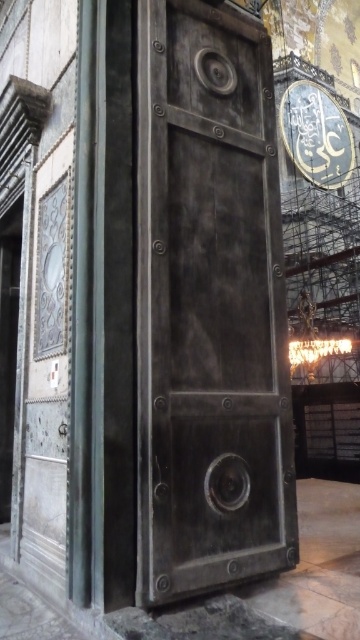
Does rusty metal door at center have a smaller size compared to shiny metallic clock at center?

Yes, rusty metal door at center is smaller than shiny metallic clock at center.

Is rusty metal door at center thinner than shiny metallic clock at center?

Indeed, rusty metal door at center has a lesser width compared to shiny metallic clock at center.

Identify the location of rusty metal door at center. This screenshot has width=360, height=640. [209, 307].